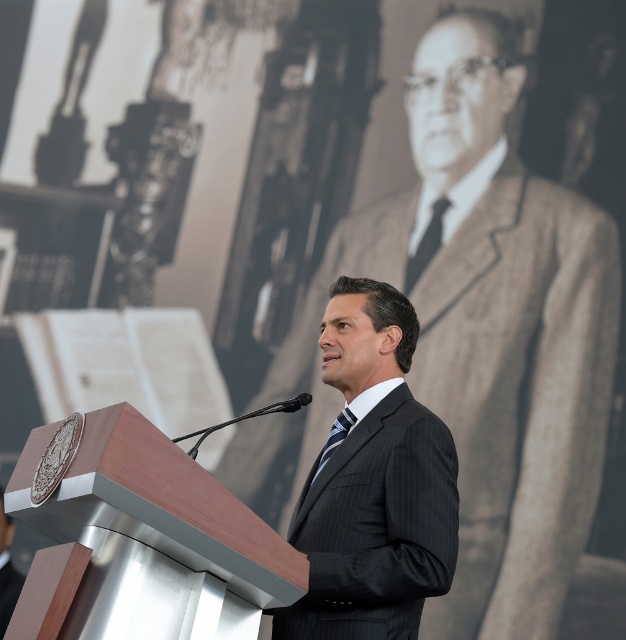
Does black pinstripe suit at center appear over striped fabric tie at center?

No, black pinstripe suit at center is not above striped fabric tie at center.

Does black pinstripe suit at center have a lesser width compared to striped fabric tie at center?

No.

Identify the location of black pinstripe suit at center. The width and height of the screenshot is (626, 640). coord(6,570).

Between pinstriped suit at center and striped fabric tie at center, which one is positioned lower?

pinstriped suit at center is below.

Does point (351, 358) come closer to viewer compared to point (347, 432)?

No, it is not.

I want to click on pinstriped suit at center, so click(x=372, y=483).

Does point (441, 225) come behind point (331, 445)?

Yes, it is.

What do you see at coordinates (426, 244) in the screenshot? This screenshot has height=640, width=626. I see `black silk tie at center` at bounding box center [426, 244].

I want to click on black silk tie at center, so click(426, 244).